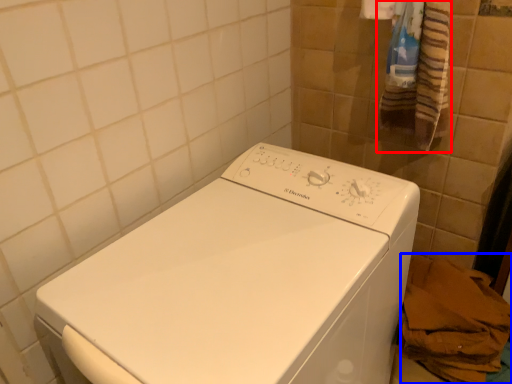
Question: Which object appears farthest to the camera in this image, bath towel (highlighted by a red box) or material (highlighted by a blue box)?

Choices:
 (A) bath towel
 (B) material

Answer: (B)